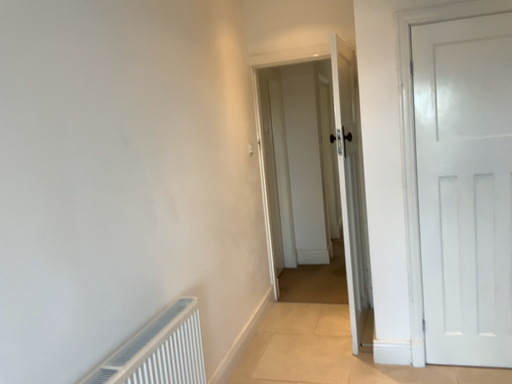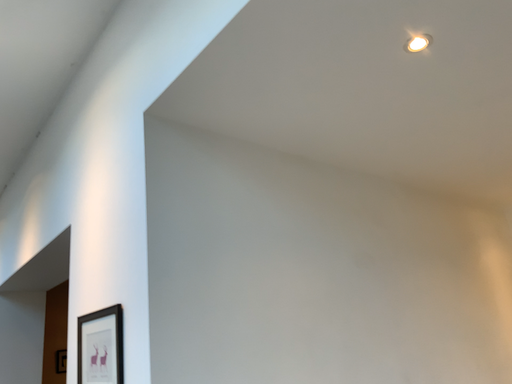
Question: How did the camera likely rotate when shooting the video?

Choices:
 (A) rotated right
 (B) rotated left

Answer: (B)